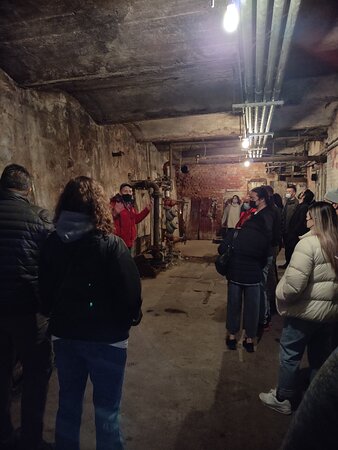
Where is `ceiling`? This screenshot has width=338, height=450. ceiling is located at coordinates (125, 23), (181, 125), (166, 101), (216, 149), (311, 113), (310, 82), (312, 60), (317, 23).